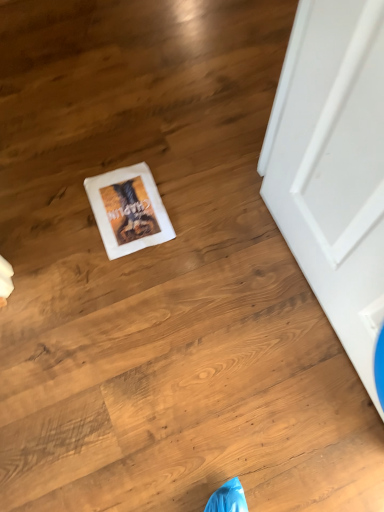
The height and width of the screenshot is (512, 384). What are the coordinates of `unoccupied region to the right of white paper postcard at center` in the screenshot? It's located at (194, 192).